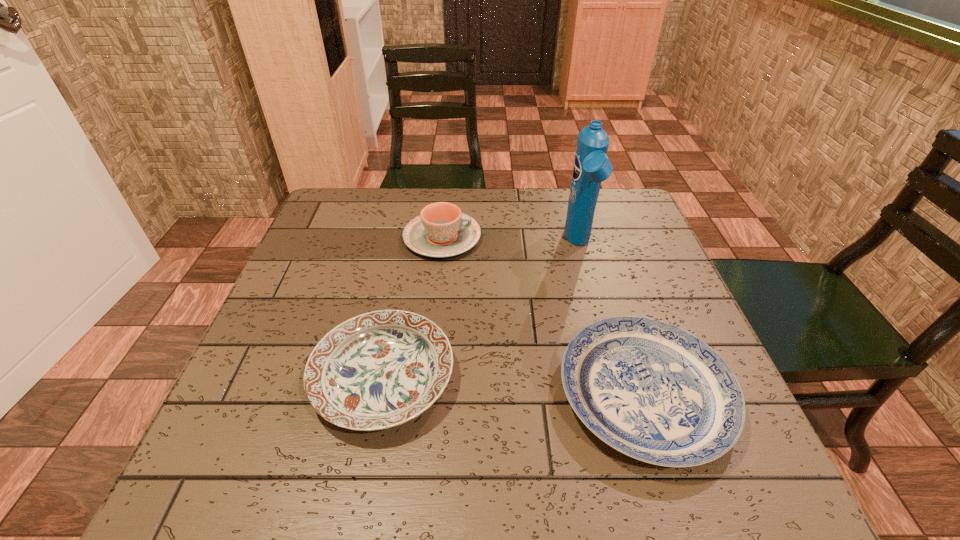
At what (x,y) coordinates should I click in order to perform the action: click on vacant space that is in between the chinaware and the right plate. Please return your answer as a coordinate pair (x, y). The image size is (960, 540). Looking at the image, I should click on (543, 316).

Image resolution: width=960 pixels, height=540 pixels. I want to click on empty location between the left plate and the tallest object, so [x=481, y=311].

I want to click on vacant area that lies between the third shortest object and the left plate, so (413, 308).

The image size is (960, 540). Identify the location of unoccupied area between the shampoo and the third shortest object. (511, 241).

What are the coordinates of `free space between the chinaware and the left plate` in the screenshot? It's located at (413, 308).

You are a GUI agent. You are given a task and a screenshot of the screen. Output one action in this format:
    pyautogui.click(x=<x>, y=<y>)
    Task: Click on the vacant space that is in between the left plate and the chinaware
    This screenshot has width=960, height=540.
    Given the screenshot: What is the action you would take?
    pyautogui.click(x=413, y=308)

You are a GUI agent. You are given a task and a screenshot of the screen. Output one action in this format:
    pyautogui.click(x=<x>, y=<y>)
    Task: Click on the closest object to the right plate
    
    Given the screenshot: What is the action you would take?
    pyautogui.click(x=381, y=369)

Where is `object that is the third nearest to the left plate`? This screenshot has height=540, width=960. object that is the third nearest to the left plate is located at coordinates (591, 166).

I want to click on vacant area that satisfies the following two spatial constraints: 1. on the handle side of the shampoo; 2. on the left side of the chinaware, so click(442, 244).

The width and height of the screenshot is (960, 540). I want to click on vacant area that satisfies the following two spatial constraints: 1. on the handle side of the tallest object; 2. on the right side of the second tallest object, so click(442, 244).